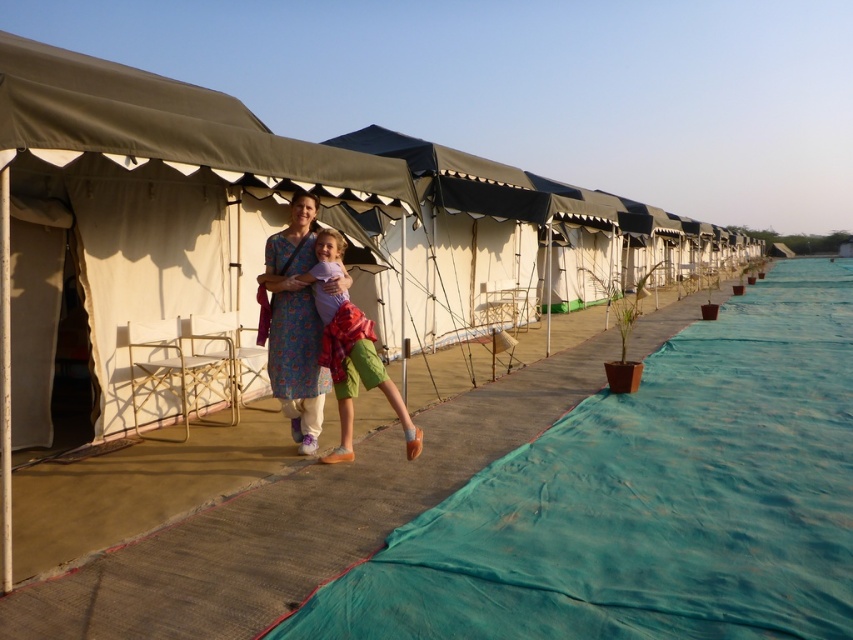
Question: Observing the image, what is the correct spatial positioning of teal fabric ramp at center in reference to floral fabric dress at center?

Choices:
 (A) below
 (B) above

Answer: (A)

Question: Which of these objects is positioned farthest from the floral fabric dress at center?

Choices:
 (A) matte purple shirt at center
 (B) teal fabric ramp at center

Answer: (B)

Question: Which of these objects is positioned farthest from the matte purple shirt at center?

Choices:
 (A) teal fabric ramp at center
 (B) floral fabric dress at center

Answer: (A)

Question: Does teal fabric ramp at center appear on the right side of matte purple shirt at center?

Choices:
 (A) yes
 (B) no

Answer: (A)

Question: Which point is closer to the camera?

Choices:
 (A) teal fabric ramp at center
 (B) matte purple shirt at center
 (C) floral fabric dress at center

Answer: (A)

Question: Does teal fabric ramp at center have a smaller size compared to floral fabric dress at center?

Choices:
 (A) yes
 (B) no

Answer: (B)